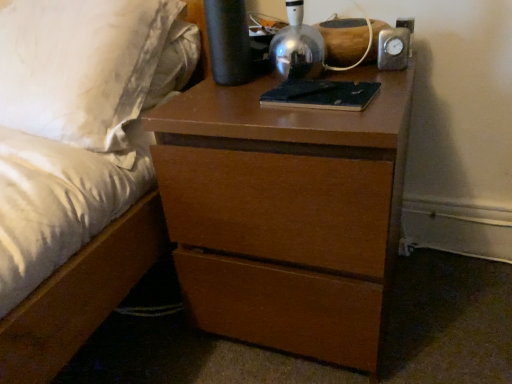
The height and width of the screenshot is (384, 512). Identify the location of vacant space situated above brown wood chest of drawers at center (from a real-world perspective). (312, 81).